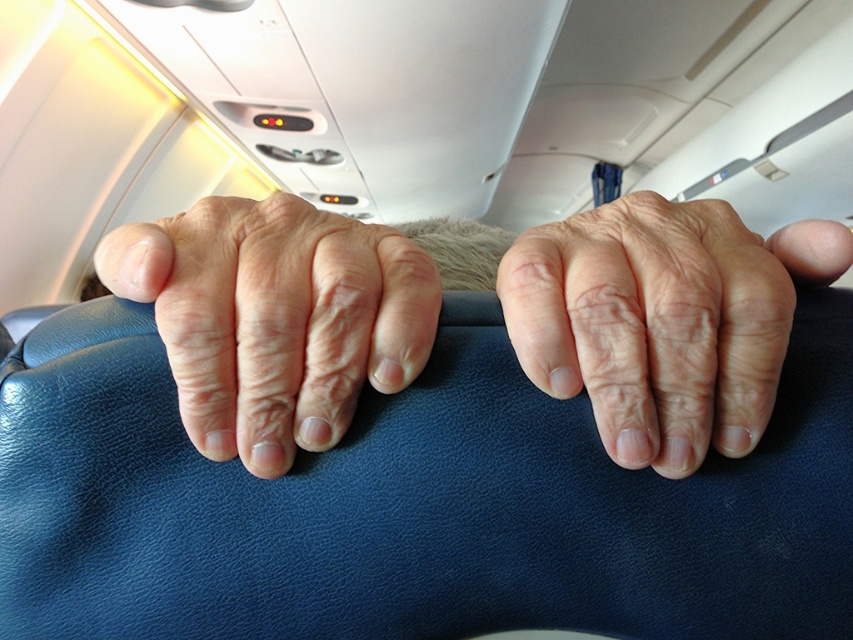
Is dry skin at center above dry skin hand at center?

No, dry skin at center is not above dry skin hand at center.

Is point (738, 381) closer to camera compared to point (248, 369)?

That is False.

Is point (537, 365) positioned in front of point (194, 324)?

That is False.

Locate an element on the screen. This screenshot has width=853, height=640. dry skin at center is located at coordinates (663, 321).

Is leather-like hands at center in front of dry skin hand at center?

Yes, it is in front of dry skin hand at center.

Does point (695, 420) lie behind point (407, 248)?

No, it is not.

In the scene shown: Who is more distant from viewer, (556,342) or (206,445)?

Point (206,445)

I want to click on leather-like hands at center, so click(663, 321).

Does leather-like hands at center appear on the left side of dry skin at center?

Yes, leather-like hands at center is to the left of dry skin at center.

Does point (149, 298) come in front of point (767, 413)?

Yes.

You are a GUI agent. You are given a task and a screenshot of the screen. Output one action in this format:
    pyautogui.click(x=<x>, y=<y>)
    Task: Click on the leather-like hands at center
    This screenshot has height=640, width=853.
    Given the screenshot: What is the action you would take?
    pyautogui.click(x=663, y=321)